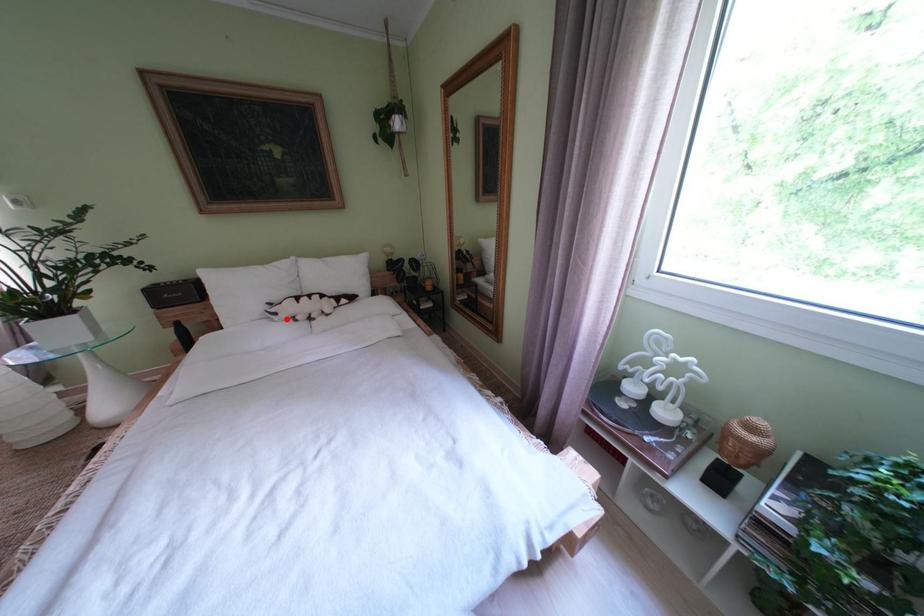
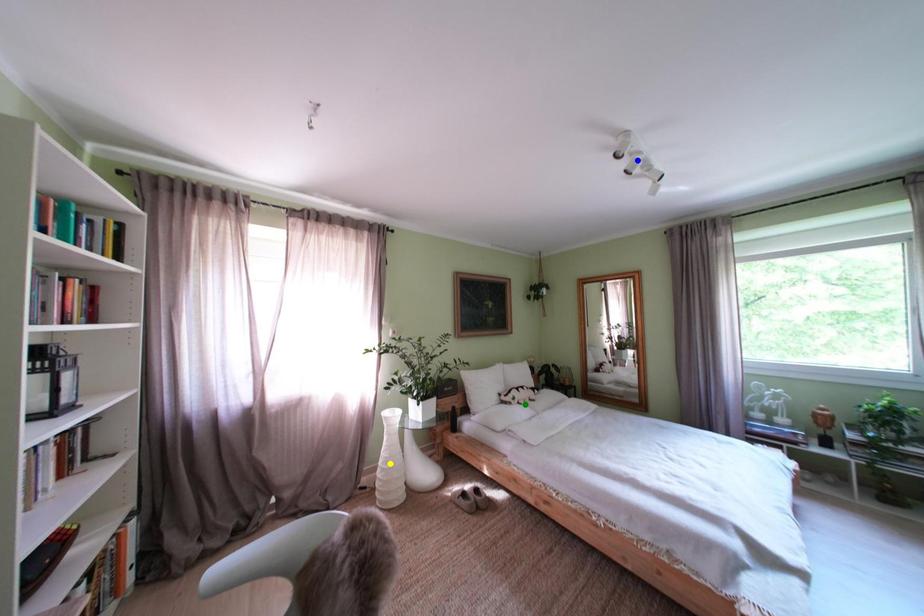
Question: I am providing you with two images of the same scene from different viewpoints. A red point is marked on the first image. You are given multiple points on the second image. Can you choose the point in image 2 that corresponds to the point in image 1?

Choices:
 (A) green point
 (B) yellow point
 (C) blue point

Answer: (A)